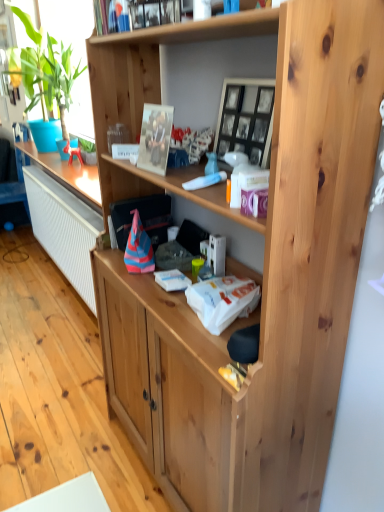
Measure the distance between point (140,147) and camera.

Point (140,147) is 4.31 feet away from camera.

What do you see at coordinates (155, 138) in the screenshot? I see `metallic silver picture frame at upper center, the 1th picture frame in the left-to-right sequence` at bounding box center [155, 138].

What do you see at coordinates (246, 119) in the screenshot?
I see `black glass picture frame at upper center, which ranks as the second picture frame in left-to-right order` at bounding box center [246, 119].

Identify the location of green leafy plant at left. (68, 24).

Considering the sizes of objects green leafy plant at left and black glass picture frame at upper center, which ranks as the second picture frame in left-to-right order, in the image provided, who is bigger, green leafy plant at left or black glass picture frame at upper center, which ranks as the second picture frame in left-to-right order,?

green leafy plant at left is bigger.

Is green leafy plant at left facing towards black glass picture frame at upper center, which ranks as the second picture frame in left-to-right order?

No, green leafy plant at left does not turn towards black glass picture frame at upper center, which ranks as the second picture frame in left-to-right order.

Is green leafy plant at left spatially inside black glass picture frame at upper center, which is the 1th picture frame from right to left, or outside of it?

green leafy plant at left is spatially situated outside black glass picture frame at upper center, which is the 1th picture frame from right to left.

From a real-world perspective, who is located higher, green leafy plant at left or black glass picture frame at upper center, which ranks as the second picture frame in left-to-right order?

green leafy plant at left is physically above.

Where is `book above the metallic silver picture frame at upper center, the 2th picture frame in the right-to-left sequence (from a real-world perspective)`? book above the metallic silver picture frame at upper center, the 2th picture frame in the right-to-left sequence (from a real-world perspective) is located at coordinates (134, 14).

Is metallic silver picture frame at upper center, the 1th picture frame in the left-to-right sequence, positioned beyond the bounds of metallic silver photo frame at upper center?

Indeed, metallic silver picture frame at upper center, the 1th picture frame in the left-to-right sequence, is completely outside metallic silver photo frame at upper center.

Can you confirm if metallic silver picture frame at upper center, the 1th picture frame in the left-to-right sequence, is taller than metallic silver photo frame at upper center?

Correct, metallic silver picture frame at upper center, the 1th picture frame in the left-to-right sequence, is much taller as metallic silver photo frame at upper center.

Who is smaller, black glass picture frame at upper center, which ranks as the second picture frame in left-to-right order, or metallic silver picture frame at upper center, the 2th picture frame in the right-to-left sequence?

metallic silver picture frame at upper center, the 2th picture frame in the right-to-left sequence, is smaller.

Does black glass picture frame at upper center, which ranks as the second picture frame in left-to-right order, turn towards metallic silver picture frame at upper center, the 2th picture frame in the right-to-left sequence?

Yes, black glass picture frame at upper center, which ranks as the second picture frame in left-to-right order, is facing metallic silver picture frame at upper center, the 2th picture frame in the right-to-left sequence.

Can you confirm if black glass picture frame at upper center, which is the 1th picture frame from right to left, is positioned to the right of metallic silver picture frame at upper center, the 1th picture frame in the left-to-right sequence?

Correct, you'll find black glass picture frame at upper center, which is the 1th picture frame from right to left, to the right of metallic silver picture frame at upper center, the 1th picture frame in the left-to-right sequence.

Looking at this image, is black glass picture frame at upper center, which ranks as the second picture frame in left-to-right order, turned away from green leafy plant at left?

No, black glass picture frame at upper center, which ranks as the second picture frame in left-to-right order, is not facing away from green leafy plant at left.

Considering the relative sizes of black glass picture frame at upper center, which is the 1th picture frame from right to left, and green leafy plant at left in the image provided, is black glass picture frame at upper center, which is the 1th picture frame from right to left, bigger than green leafy plant at left?

Incorrect, black glass picture frame at upper center, which is the 1th picture frame from right to left, is not larger than green leafy plant at left.

In the scene shown: From the image's perspective, who appears lower, black glass picture frame at upper center, which ranks as the second picture frame in left-to-right order, or green leafy plant at left?

black glass picture frame at upper center, which ranks as the second picture frame in left-to-right order.

Is point (235, 128) positioned after point (52, 7)?

No.

Could you measure the distance between metallic silver photo frame at upper center and black glass picture frame at upper center, which is the 1th picture frame from right to left?

The distance of metallic silver photo frame at upper center from black glass picture frame at upper center, which is the 1th picture frame from right to left, is 12.43 inches.

Could you tell me if metallic silver photo frame at upper center is turned towards black glass picture frame at upper center, which is the 1th picture frame from right to left?

No, metallic silver photo frame at upper center does not turn towards black glass picture frame at upper center, which is the 1th picture frame from right to left.

Which of these two, metallic silver photo frame at upper center or black glass picture frame at upper center, which is the 1th picture frame from right to left, stands taller?

Standing taller between the two is black glass picture frame at upper center, which is the 1th picture frame from right to left.

Is metallic silver photo frame at upper center bigger or smaller than black glass picture frame at upper center, which ranks as the second picture frame in left-to-right order?

Considering their sizes, metallic silver photo frame at upper center takes up less space than black glass picture frame at upper center, which ranks as the second picture frame in left-to-right order.

Consider the image. Who is smaller, metallic silver photo frame at upper center or green leafy plant at left?

With smaller size is metallic silver photo frame at upper center.

Is metallic silver photo frame at upper center next to green leafy plant at left?

No, metallic silver photo frame at upper center is not beside green leafy plant at left.

The width and height of the screenshot is (384, 512). Find the location of `book above the green leafy plant at left (from a real-world perspective)`. book above the green leafy plant at left (from a real-world perspective) is located at coordinates tap(134, 14).

From the image's perspective, who appears lower, green leafy plant at left or metallic silver photo frame at upper center?

metallic silver photo frame at upper center.

Which point is more distant from viewer, (75,117) or (151,1)?

The point (75,117) is more distant.

From a real-world perspective, which object rests below the other?

green leafy plant at left is physically lower.

In the image, is green leafy plant at left positioned in front of or behind metallic silver photo frame at upper center?

green leafy plant at left is positioned farther from the viewer than metallic silver photo frame at upper center.

This screenshot has height=512, width=384. I want to click on picture frame that is the 1st one when counting downward from the green leafy plant at left (from the image's perspective), so click(246, 119).

Locate an element on the screen. This screenshot has height=512, width=384. book behind the metallic silver picture frame at upper center, the 2th picture frame in the right-to-left sequence is located at coordinates (134, 14).

Estimate the real-world distances between objects in this image. Which object is closer to metallic silver photo frame at upper center, green leafy plant at left or metallic silver picture frame at upper center, the 1th picture frame in the left-to-right sequence?

Based on the image, metallic silver picture frame at upper center, the 1th picture frame in the left-to-right sequence, appears to be nearer to metallic silver photo frame at upper center.

Which object lies further to the anchor point metallic silver picture frame at upper center, the 2th picture frame in the right-to-left sequence, metallic silver photo frame at upper center or black glass picture frame at upper center, which is the 1th picture frame from right to left?

Based on the image, metallic silver photo frame at upper center appears to be further to metallic silver picture frame at upper center, the 2th picture frame in the right-to-left sequence.

Based on their spatial positions, is metallic silver photo frame at upper center or metallic silver picture frame at upper center, the 2th picture frame in the right-to-left sequence, further from green leafy plant at left?

Based on the image, metallic silver picture frame at upper center, the 2th picture frame in the right-to-left sequence, appears to be further to green leafy plant at left.

Looking at the image, which one is located further to black glass picture frame at upper center, which ranks as the second picture frame in left-to-right order, metallic silver picture frame at upper center, the 1th picture frame in the left-to-right sequence, or green leafy plant at left?

green leafy plant at left is further to black glass picture frame at upper center, which ranks as the second picture frame in left-to-right order.

Based on the photo, which object lies further to the anchor point metallic silver photo frame at upper center, black glass picture frame at upper center, which ranks as the second picture frame in left-to-right order, or metallic silver picture frame at upper center, the 1th picture frame in the left-to-right sequence?

Based on the image, black glass picture frame at upper center, which ranks as the second picture frame in left-to-right order, appears to be further to metallic silver photo frame at upper center.

Estimate the real-world distances between objects in this image. Which object is closer to green leafy plant at left, metallic silver picture frame at upper center, the 1th picture frame in the left-to-right sequence, or black glass picture frame at upper center, which is the 1th picture frame from right to left?

The object closer to green leafy plant at left is metallic silver picture frame at upper center, the 1th picture frame in the left-to-right sequence.

When comparing their distances from metallic silver picture frame at upper center, the 2th picture frame in the right-to-left sequence, does green leafy plant at left or metallic silver photo frame at upper center seem further?

The object further to metallic silver picture frame at upper center, the 2th picture frame in the right-to-left sequence, is green leafy plant at left.

Based on their spatial positions, is metallic silver picture frame at upper center, the 1th picture frame in the left-to-right sequence, or metallic silver photo frame at upper center further from green leafy plant at left?

metallic silver picture frame at upper center, the 1th picture frame in the left-to-right sequence, is positioned further to the anchor green leafy plant at left.

Where is `book between black glass picture frame at upper center, which is the 1th picture frame from right to left, and green leafy plant at left from front to back`? The image size is (384, 512). book between black glass picture frame at upper center, which is the 1th picture frame from right to left, and green leafy plant at left from front to back is located at coordinates (134, 14).

Where is `picture frame positioned between black glass picture frame at upper center, which ranks as the second picture frame in left-to-right order, and green leafy plant at left from near to far`? picture frame positioned between black glass picture frame at upper center, which ranks as the second picture frame in left-to-right order, and green leafy plant at left from near to far is located at coordinates (155, 138).

At what (x,y) coordinates should I click in order to perform the action: click on picture frame between metallic silver photo frame at upper center and metallic silver picture frame at upper center, the 2th picture frame in the right-to-left sequence, from top to bottom. Please return your answer as a coordinate pair (x, y). Image resolution: width=384 pixels, height=512 pixels. Looking at the image, I should click on (246, 119).

Locate an element on the screen. book between metallic silver picture frame at upper center, the 1th picture frame in the left-to-right sequence, and green leafy plant at left in the front-back direction is located at coordinates (134, 14).